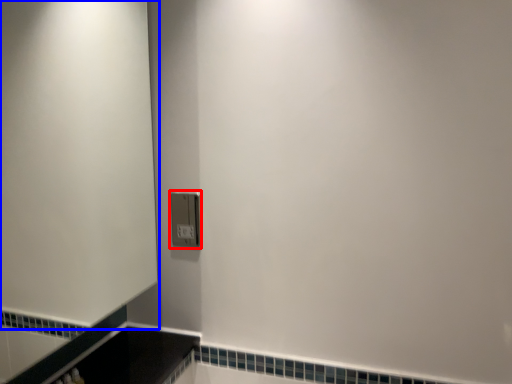
Question: Which of the following is the farthest to the observer, light switch (highlighted by a red box) or screen door (highlighted by a blue box)?

Choices:
 (A) light switch
 (B) screen door

Answer: (A)